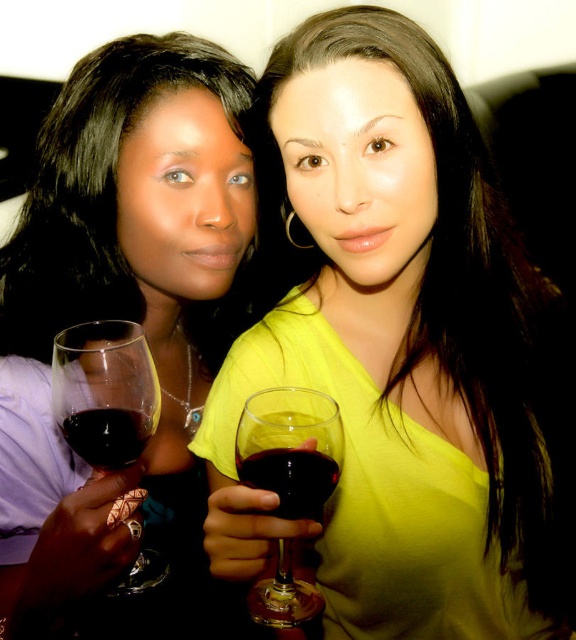
You are at a wine tasting event and see two glasses at center. Which one is more to the left? The translucent glass wine glass at center or the ruby glass at center?

The translucent glass wine glass at center is more to the left because it is positioned on the left side of the ruby glass at center.

Looking at this image, you are at a wine tasting event and see two glasses at the center of the table. The glasses are labeled as matte glass wine at center and ruby glass at center. Which glass is positioned to the right side of the table?

The matte glass wine at center is positioned to the right of the ruby glass at center, so the matte glass wine at center is on the right side of the table.